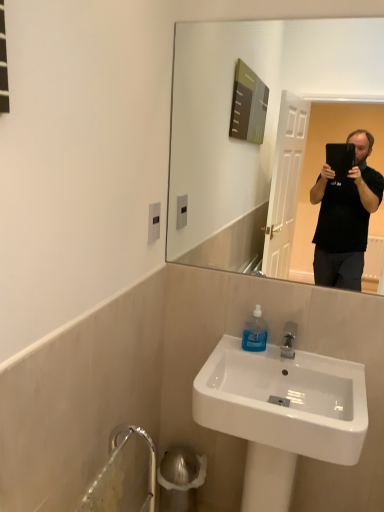
At what (x,y) coordinates should I click in order to perform the action: click on transparent plastic bottle at sink. Please return your answer as a coordinate pair (x, y). Looking at the image, I should click on coord(255,333).

What do you see at coordinates (255, 333) in the screenshot? This screenshot has height=512, width=384. I see `transparent plastic bottle at sink` at bounding box center [255, 333].

This screenshot has width=384, height=512. What do you see at coordinates (281, 413) in the screenshot?
I see `white glossy sink at lower center` at bounding box center [281, 413].

Identify the location of white glossy sink at lower center. (281, 413).

Image resolution: width=384 pixels, height=512 pixels. Find the location of `transparent plastic bottle at sink`. transparent plastic bottle at sink is located at coordinates (255, 333).

Based on their positions, is white glossy sink at lower center located to the left or right of transparent plastic bottle at sink?

In the image, white glossy sink at lower center appears on the right side of transparent plastic bottle at sink.

Which object is further away from the camera taking this photo, white glossy sink at lower center or transparent plastic bottle at sink?

transparent plastic bottle at sink.

Considering the positions of points (271, 439) and (266, 332), is point (271, 439) closer to camera compared to point (266, 332)?

Yes, point (271, 439) is in front of point (266, 332).

From the image's perspective, is white glossy sink at lower center on transparent plastic bottle at sink?

Incorrect, from the image's perspective, white glossy sink at lower center is lower than transparent plastic bottle at sink.

From a real-world perspective, is white glossy sink at lower center located beneath transparent plastic bottle at sink?

Yes, from a real-world perspective, white glossy sink at lower center is below transparent plastic bottle at sink.

Is white glossy sink at lower center wider than transparent plastic bottle at sink?

Correct, the width of white glossy sink at lower center exceeds that of transparent plastic bottle at sink.

Looking at this image, which of these two, white glossy sink at lower center or transparent plastic bottle at sink, stands shorter?

With less height is transparent plastic bottle at sink.

Between white glossy sink at lower center and transparent plastic bottle at sink, which one has smaller size?

transparent plastic bottle at sink is smaller.

Is white glossy sink at lower center inside or outside of transparent plastic bottle at sink?

white glossy sink at lower center is located beyond the bounds of transparent plastic bottle at sink.

Is white glossy sink at lower center not near transparent plastic bottle at sink?

That's not correct — white glossy sink at lower center is a little close to transparent plastic bottle at sink.

Is white glossy sink at lower center turned away from transparent plastic bottle at sink?

That's right, white glossy sink at lower center is facing away from transparent plastic bottle at sink.

What's the angular difference between white glossy sink at lower center and transparent plastic bottle at sink's facing directions?

1.21 degrees.

Locate an element on the screen. The width and height of the screenshot is (384, 512). sink that appears in front of the transparent plastic bottle at sink is located at coordinates (281, 413).

Between transparent plastic bottle at sink and white glossy sink at lower center, which one appears on the left side from the viewer's perspective?

transparent plastic bottle at sink is more to the left.

Between transparent plastic bottle at sink and white glossy sink at lower center, which one is positioned behind?

transparent plastic bottle at sink is behind.

Considering the positions of points (258, 305) and (226, 381), is point (258, 305) closer to camera compared to point (226, 381)?

No, (258, 305) is further to viewer.

From the image's perspective, is transparent plastic bottle at sink positioned above or below white glossy sink at lower center?

transparent plastic bottle at sink is situated higher than white glossy sink at lower center in the image.

From a real-world perspective, who is located higher, transparent plastic bottle at sink or white glossy sink at lower center?

transparent plastic bottle at sink is physically above.

Considering the sizes of transparent plastic bottle at sink and white glossy sink at lower center in the image, is transparent plastic bottle at sink wider or thinner than white glossy sink at lower center?

Clearly, transparent plastic bottle at sink has less width compared to white glossy sink at lower center.

Is transparent plastic bottle at sink taller or shorter than white glossy sink at lower center?

Clearly, transparent plastic bottle at sink is shorter compared to white glossy sink at lower center.

Can you confirm if transparent plastic bottle at sink is smaller than white glossy sink at lower center?

Correct, transparent plastic bottle at sink occupies less space than white glossy sink at lower center.

Would you say transparent plastic bottle at sink is outside white glossy sink at lower center?

No, transparent plastic bottle at sink is not outside of white glossy sink at lower center.

Are transparent plastic bottle at sink and white glossy sink at lower center located far from each other?

That's not correct — transparent plastic bottle at sink is a little close to white glossy sink at lower center.

Looking at this image, is transparent plastic bottle at sink facing away from white glossy sink at lower center?

Yes, transparent plastic bottle at sink's orientation is away from white glossy sink at lower center.

You are a GUI agent. You are given a task and a screenshot of the screen. Output one action in this format:
    pyautogui.click(x=<x>, y=<y>)
    Task: Click on the bottle on the left of white glossy sink at lower center
    The width and height of the screenshot is (384, 512).
    Given the screenshot: What is the action you would take?
    pyautogui.click(x=255, y=333)

Locate an element on the screen. sink on the right of transparent plastic bottle at sink is located at coordinates (281, 413).

The height and width of the screenshot is (512, 384). What are the coordinates of `bottle behind the white glossy sink at lower center` in the screenshot? It's located at (255, 333).